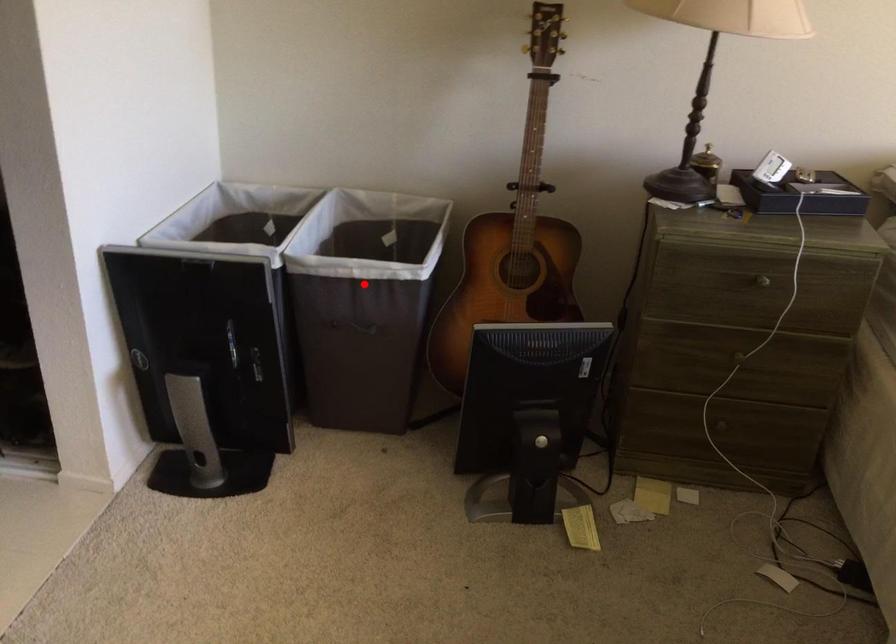
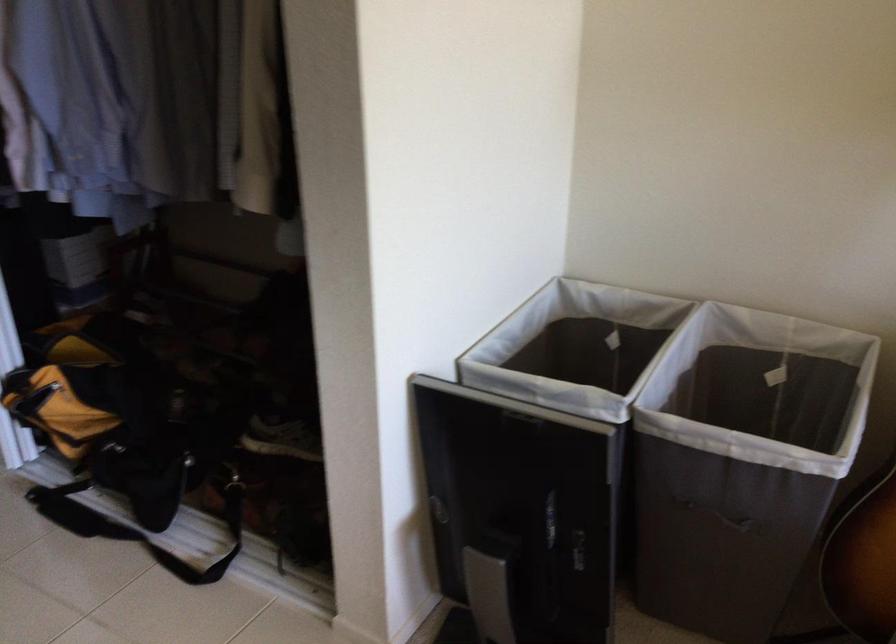
Where in the second image is the point corresponding to the highlighted location from the first image?

(742, 462)